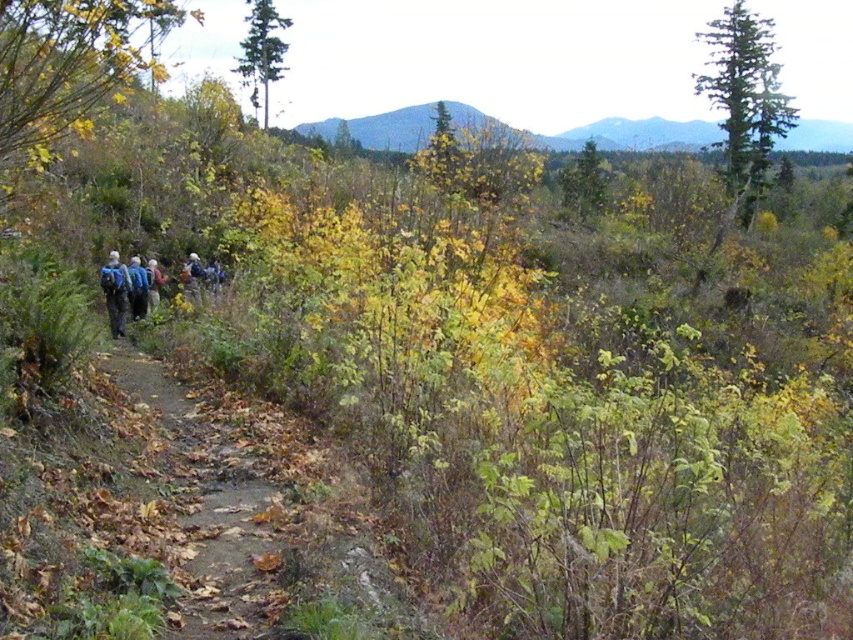
Question: Does green textured tree at upper center lie behind blue backpack at left?

Choices:
 (A) no
 (B) yes

Answer: (B)

Question: Which point is closer to the camera?

Choices:
 (A) (155, 266)
 (B) (169, 10)

Answer: (A)

Question: Which point is farther to the camera?

Choices:
 (A) smooth gray mountain at upper center
 (B) yellow-green foliage at left
 (C) blue backpack at center
 (D) green textured tree at upper right

Answer: (A)

Question: Does green textured tree at upper center lie in front of blue backpack at left?

Choices:
 (A) no
 (B) yes

Answer: (A)

Question: From the image, what is the correct spatial relationship of smooth gray mountain at upper center in relation to light brown fabric jacket at center?

Choices:
 (A) above
 (B) below

Answer: (A)

Question: Which point appears farthest from the camera in this image?

Choices:
 (A) (131, 260)
 (B) (260, 19)

Answer: (B)